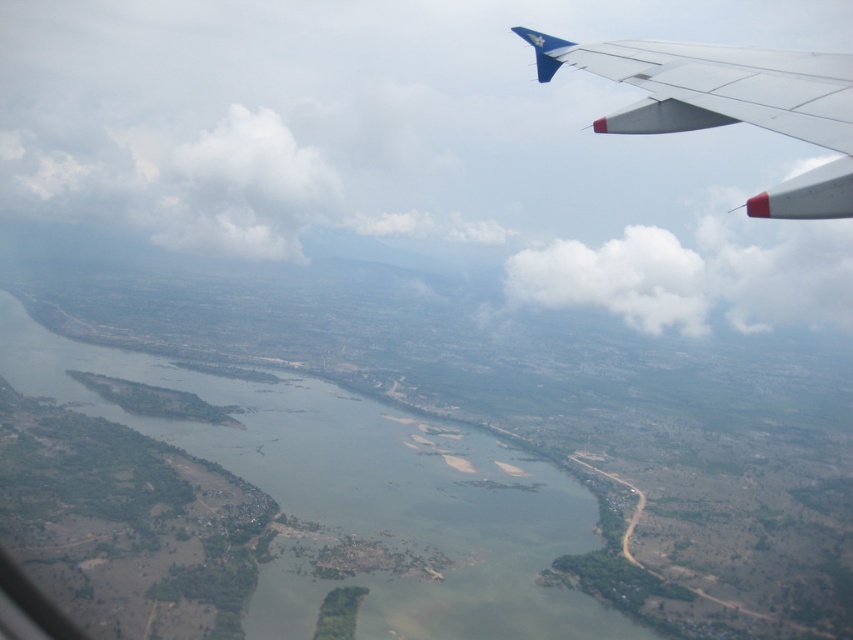
Is point (345, 436) closer to viewer compared to point (624, 298)?

Yes, it is.

Identify the location of green sedimentary river at center. (358, 496).

Where is `green sedimentary river at center`? Image resolution: width=853 pixels, height=640 pixels. green sedimentary river at center is located at coordinates (358, 496).

Does white matte wing at upper right have a lesser width compared to white fluffy cloud at center?

Yes, white matte wing at upper right is thinner than white fluffy cloud at center.

Is white matte wing at upper right above white fluffy cloud at center?

No.

Is point (798, 136) behind point (582, 244)?

No, it is not.

The image size is (853, 640). Find the location of `white matte wing at upper right`. white matte wing at upper right is located at coordinates (729, 104).

Does green sedimentary river at center appear on the left side of white matte wing at upper right?

Indeed, green sedimentary river at center is positioned on the left side of white matte wing at upper right.

Is green sedimentary river at center closer to the viewer compared to white matte wing at upper right?

No, it is behind white matte wing at upper right.

Locate an element on the screen. Image resolution: width=853 pixels, height=640 pixels. green sedimentary river at center is located at coordinates (358, 496).